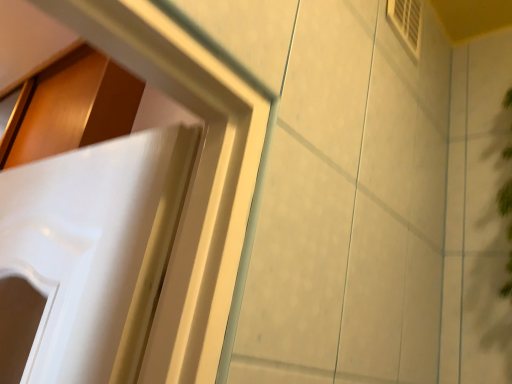
What do you see at coordinates (407, 23) in the screenshot? This screenshot has height=384, width=512. I see `white plastic air conditioner at upper right` at bounding box center [407, 23].

Locate an element on the screen. The width and height of the screenshot is (512, 384). white plastic air conditioner at upper right is located at coordinates (407, 23).

Where is `white plastic air conditioner at upper right`? The width and height of the screenshot is (512, 384). white plastic air conditioner at upper right is located at coordinates (407, 23).